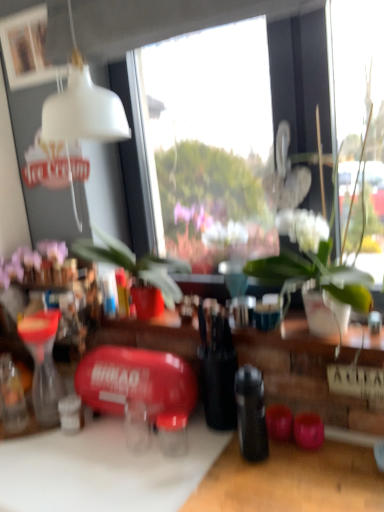
Where is `vacant area that is in front of black matte bottle at center`? Image resolution: width=384 pixels, height=512 pixels. vacant area that is in front of black matte bottle at center is located at coordinates (261, 494).